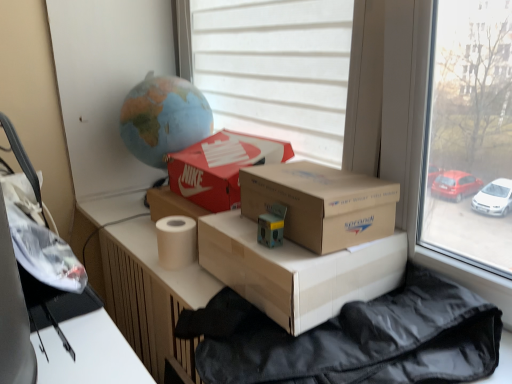
Where is `free location in front of matte green plastic toy at center`? free location in front of matte green plastic toy at center is located at coordinates (287, 264).